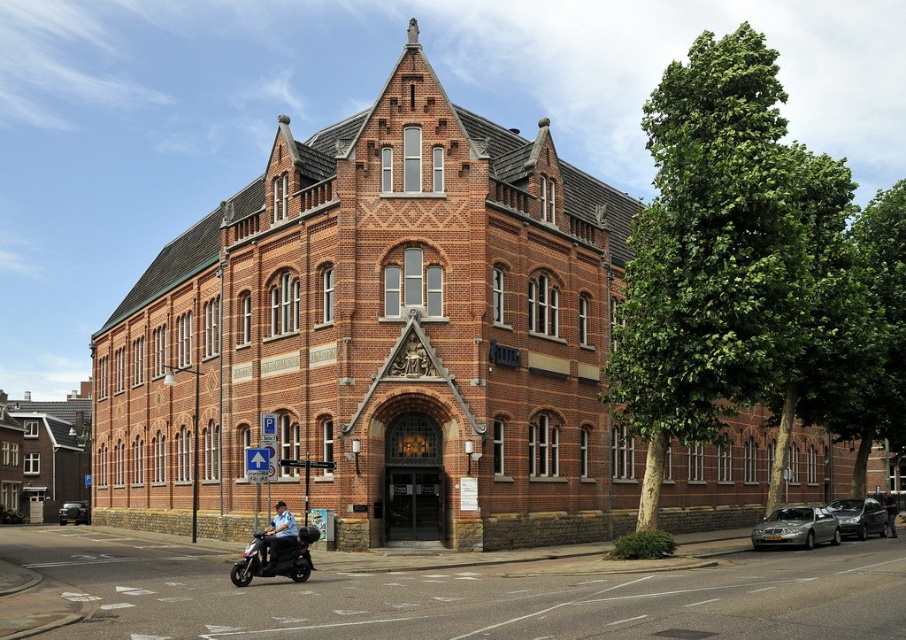
Is point (802, 524) in front of point (868, 506)?

Yes, it is in front of point (868, 506).

Is satin silver metallic sedan at lower right in front of shiny silver sedan at lower right?

Yes, it is in front of shiny silver sedan at lower right.

I want to click on satin silver metallic sedan at lower right, so click(x=796, y=528).

At what (x,y) coordinates should I click in order to perform the action: click on satin silver metallic sedan at lower right. Please return your answer as a coordinate pair (x, y). Looking at the image, I should click on (796, 528).

Can you confirm if brick building at center is shorter than dark blue uniform at center?

Incorrect, brick building at center's height does not fall short of dark blue uniform at center's.

Is brick building at center below dark blue uniform at center?

No.

What do you see at coordinates (381, 339) in the screenshot? I see `brick building at center` at bounding box center [381, 339].

This screenshot has width=906, height=640. I want to click on brick building at center, so click(381, 339).

Is brick building at center wider than shiny silver sedan at lower right?

Yes, brick building at center is wider than shiny silver sedan at lower right.

Is point (431, 424) behind point (847, 529)?

No, (431, 424) is closer to viewer.

The height and width of the screenshot is (640, 906). I want to click on brick building at center, so click(x=381, y=339).